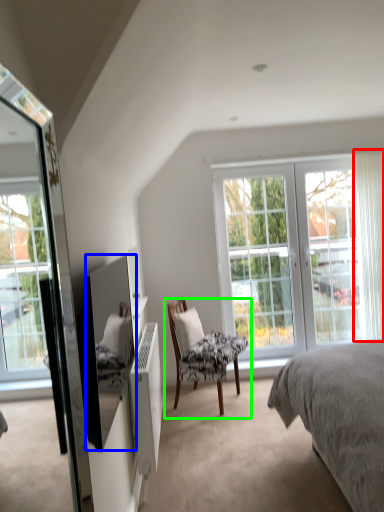
Question: Which object is positioned closest to curtain (highlighted by a red box)? Select from mirror (highlighted by a blue box) and chair (highlighted by a green box).

Choices:
 (A) mirror
 (B) chair

Answer: (B)